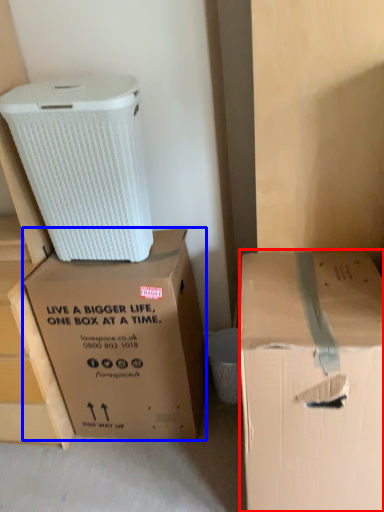
Question: Which point is further to the camera, box (highlighted by a red box) or box (highlighted by a blue box)?

Choices:
 (A) box
 (B) box

Answer: (B)